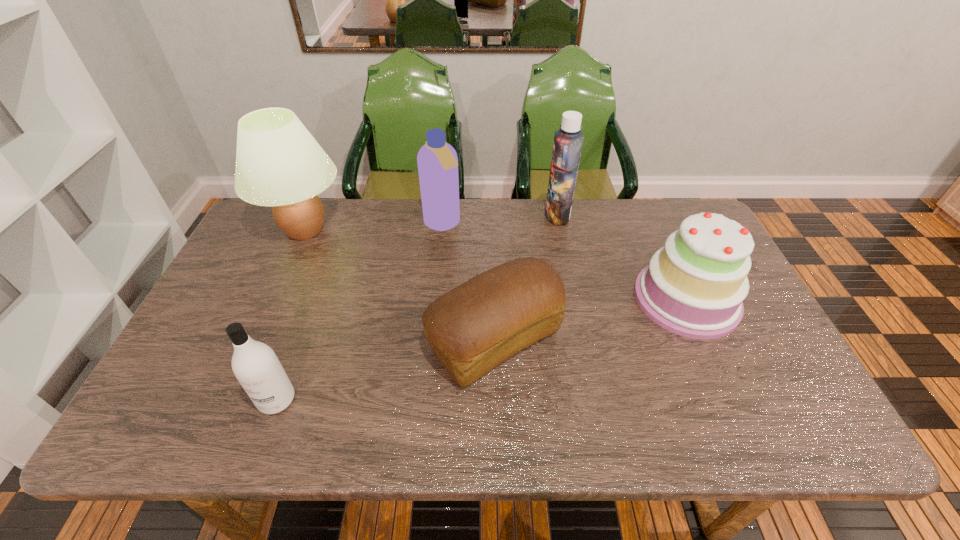
Locate an element on the screen. This screenshot has height=540, width=960. vacant space located on the front label of the rightmost shampoo is located at coordinates (524, 214).

This screenshot has width=960, height=540. What are the coordinates of `vacant space located 0.280m on the left of the second shampoo from right to left` in the screenshot? It's located at (339, 224).

I want to click on vacant space located on the back of the cake, so click(644, 203).

Where is `vacant area situated 0.350m on the left of the bread`? The width and height of the screenshot is (960, 540). vacant area situated 0.350m on the left of the bread is located at coordinates (290, 340).

Locate an element on the screen. This screenshot has height=540, width=960. lampshade that is at the far edge is located at coordinates click(x=279, y=163).

Where is `object situated at the near edge`? object situated at the near edge is located at coordinates (255, 365).

What are the coordinates of `object situated at the left edge` in the screenshot? It's located at (279, 163).

I want to click on object that is at the right edge, so click(x=694, y=286).

This screenshot has width=960, height=540. I want to click on object that is at the far left corner, so click(279, 163).

In the image, there is a desktop. What are the coordinates of `vacant space at the far edge` in the screenshot? It's located at (537, 241).